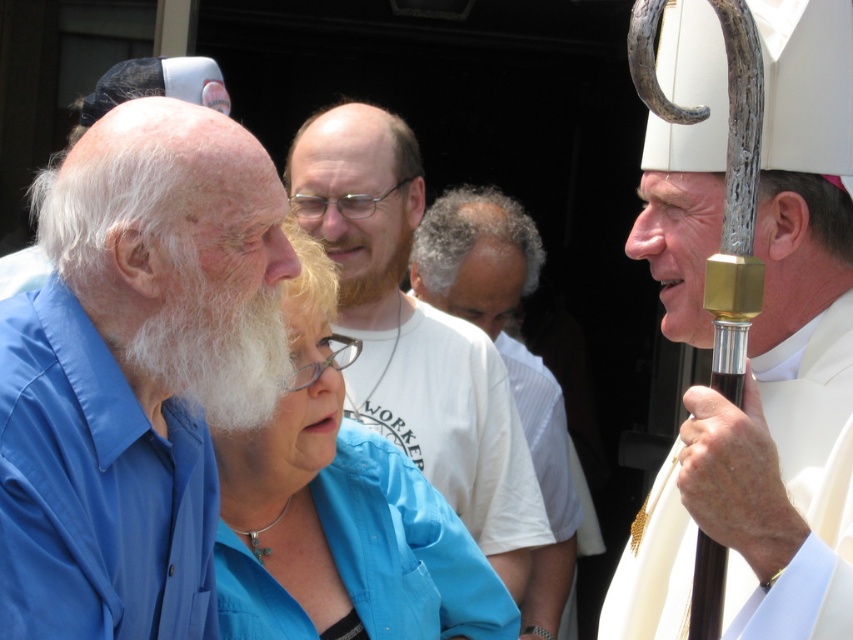
Based on the photo, you are a photographer at the event and need to capture a photo of both the white matte staff at center and the white fluffy beard at left. Which object should you focus on first to ensure it is in the foreground?

The white matte staff at center is much taller than the white fluffy beard at left, so you should focus on the white fluffy beard at left first to ensure it is in the foreground since it is closer to the camera.

Looking at the scene, where is the blue cotton shirt at left in relation to the white cotton shirt at center?

The blue cotton shirt at left is positioned to the left of the white cotton shirt at center.